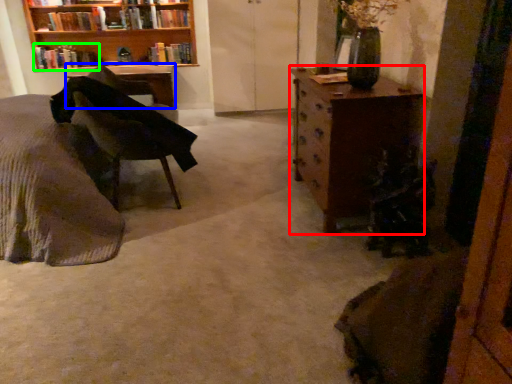
Question: Considering the real-world distances, which object is farthest from chest of drawers (highlighted by a red box)? desk (highlighted by a blue box) or book (highlighted by a green box)?

Choices:
 (A) desk
 (B) book

Answer: (B)